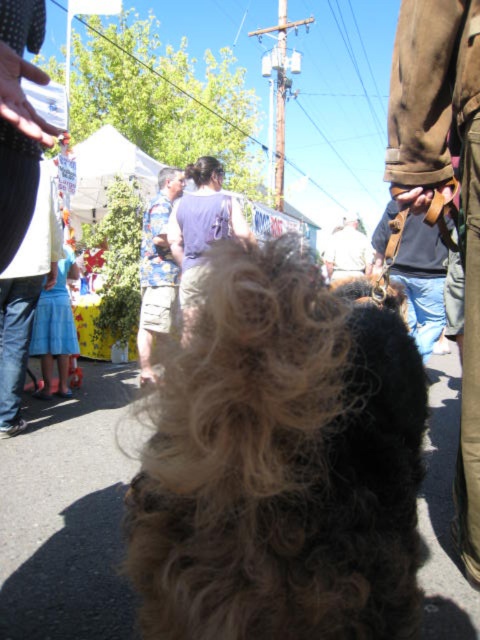
You are a tailor measuring items for alterations. You have a measuring tape that can only measure up to 30 cm. You need to determine which item, the brown leather belt at upper right or the blue denim skirt at lower left, is wider without exceeding your tape measure. Can you do this by comparing their widths?

The brown leather belt at upper right is wider than the blue denim skirt at lower left, so you can measure the blue denim skirt at lower left first. If its width is under 30 cm, note it, then measure the brown leather belt at upper right. If the belt exceeds the tape measure, you can conclude it is wider without needing an exact measurement.

You are a photographer at the event and want to capture both the floral shirt at center and the matte blue dress at lower left in a single shot. Which object should you focus on first to ensure both are in frame?

The floral shirt at center is much taller than the matte blue dress at lower left. To ensure both are in frame, focus on the floral shirt at center first as it occupies more vertical space.